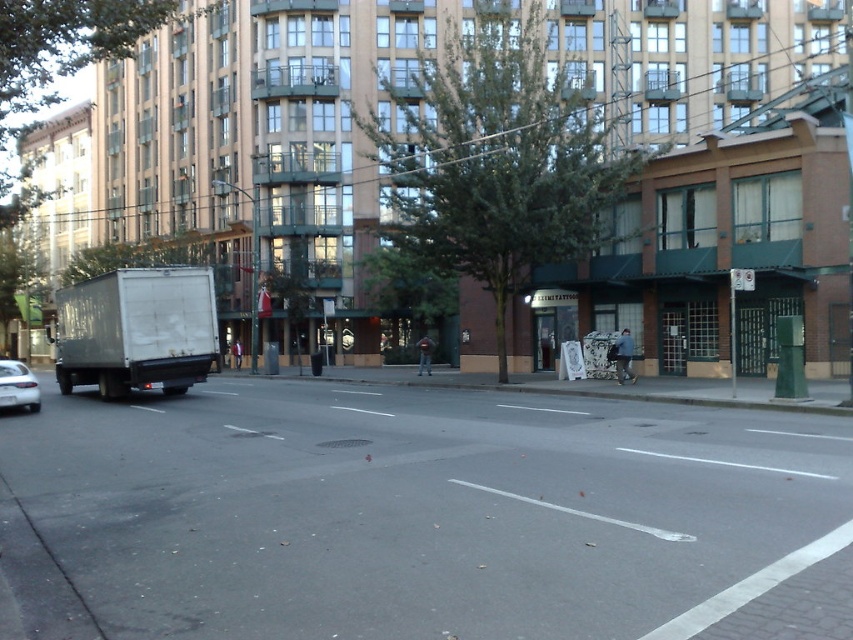
Can you confirm if white matte truck at left is thinner than white matte sedan at lower left?

No, white matte truck at left is not thinner than white matte sedan at lower left.

Between white matte truck at left and white matte sedan at lower left, which one is positioned lower?

white matte sedan at lower left

Describe the element at coordinates (136, 330) in the screenshot. I see `white matte truck at left` at that location.

This screenshot has width=853, height=640. Identify the location of white matte truck at left. (136, 330).